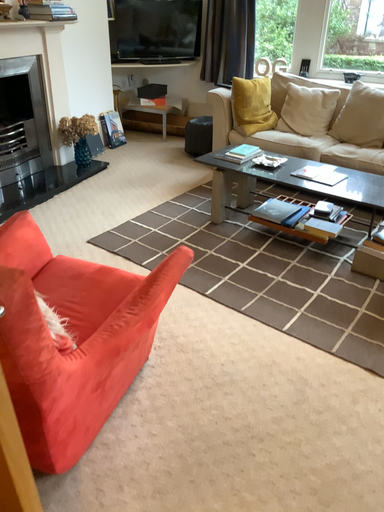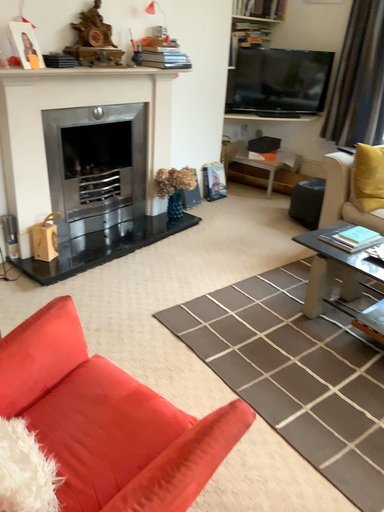
Question: Which way did the camera rotate in the video?

Choices:
 (A) rotated left
 (B) rotated right

Answer: (A)